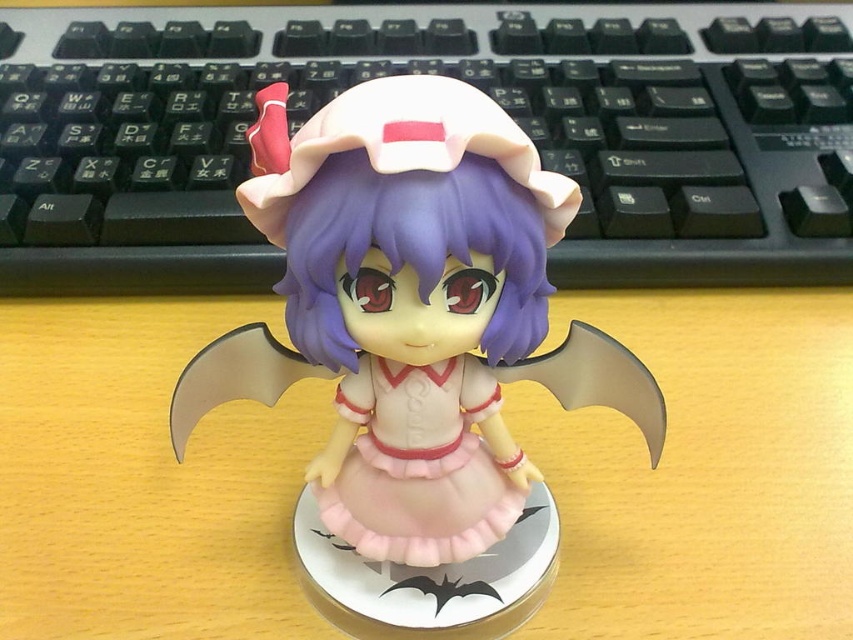
You are an interior designer arranging a room. You have a wooden table at center and a pink satin dress at center. Which object is positioned lower in the scene?

The wooden table at center is positioned lower than the pink satin dress at center because the wooden table at center is below pink satin dress at center.

You are organizing items on a desk and need to place the black plastic keyboard at center and the pink satin dress at center. Which item should you place first if you want to ensure there is enough space for both?

The black plastic keyboard at center is much taller than the pink satin dress at center. Therefore, you should place the black plastic keyboard at center first to ensure there is enough space for both items.

You are organizing a display on a small shelf and need to ensure the items fit. Given that the shelf has limited space, will the matte pink plastic figurine at center and the pink satin dress at center both fit if placed side by side?

The matte pink plastic figurine at center is bigger than the pink satin dress at center, so there is a possibility they may not both fit side by side on the shelf due to the combined size, but it depends on the exact dimensions of the shelf space available.